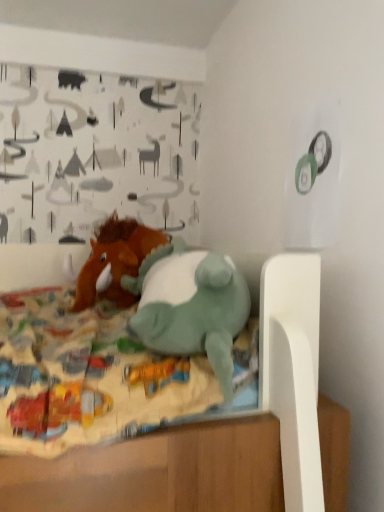
Question: From the image's perspective, would you say teal plush dinosaur at center, the first toy viewed from the front, is shown under fuzzy brown stuffed horse at center, which is counted as the 1th toy, starting from the back?

Choices:
 (A) yes
 (B) no

Answer: (A)

Question: Does teal plush dinosaur at center, the first toy viewed from the front, have a lesser height compared to fuzzy brown stuffed horse at center, the second toy from the front?

Choices:
 (A) no
 (B) yes

Answer: (B)

Question: Is teal plush dinosaur at center, the second toy positioned from the back, closer to camera compared to fuzzy brown stuffed horse at center, the second toy from the front?

Choices:
 (A) yes
 (B) no

Answer: (A)

Question: From the image's perspective, is teal plush dinosaur at center, the first toy viewed from the front, on top of fuzzy brown stuffed horse at center, the second toy from the front?

Choices:
 (A) yes
 (B) no

Answer: (B)

Question: From a real-world perspective, is teal plush dinosaur at center, the second toy positioned from the back, over fuzzy brown stuffed horse at center, which is counted as the 1th toy, starting from the back?

Choices:
 (A) yes
 (B) no

Answer: (B)

Question: Considering the relative sizes of teal plush dinosaur at center, the first toy viewed from the front, and fuzzy brown stuffed horse at center, the second toy from the front, in the image provided, is teal plush dinosaur at center, the first toy viewed from the front, bigger than fuzzy brown stuffed horse at center, the second toy from the front,?

Choices:
 (A) no
 (B) yes

Answer: (B)

Question: From the image's perspective, does fuzzy brown stuffed horse at center, the second toy from the front, appear higher than teal plush dinosaur at center, the first toy viewed from the front?

Choices:
 (A) no
 (B) yes

Answer: (B)

Question: Does fuzzy brown stuffed horse at center, the second toy from the front, have a lesser width compared to teal plush dinosaur at center, the first toy viewed from the front?

Choices:
 (A) yes
 (B) no

Answer: (B)

Question: Are fuzzy brown stuffed horse at center, which is counted as the 1th toy, starting from the back, and teal plush dinosaur at center, the second toy positioned from the back, beside each other?

Choices:
 (A) no
 (B) yes

Answer: (A)

Question: From the image's perspective, is fuzzy brown stuffed horse at center, the second toy from the front, located beneath teal plush dinosaur at center, the second toy positioned from the back?

Choices:
 (A) yes
 (B) no

Answer: (B)

Question: Considering the relative positions of fuzzy brown stuffed horse at center, the second toy from the front, and teal plush dinosaur at center, the second toy positioned from the back, in the image provided, is fuzzy brown stuffed horse at center, the second toy from the front, to the right of teal plush dinosaur at center, the second toy positioned from the back, from the viewer's perspective?

Choices:
 (A) no
 (B) yes

Answer: (A)

Question: Is fuzzy brown stuffed horse at center, the second toy from the front, closer to the viewer compared to teal plush dinosaur at center, the first toy viewed from the front?

Choices:
 (A) yes
 (B) no

Answer: (B)

Question: Is teal plush dinosaur at center, the second toy positioned from the back, to the left or to the right of fuzzy brown stuffed horse at center, which is counted as the 1th toy, starting from the back, in the image?

Choices:
 (A) right
 (B) left

Answer: (A)